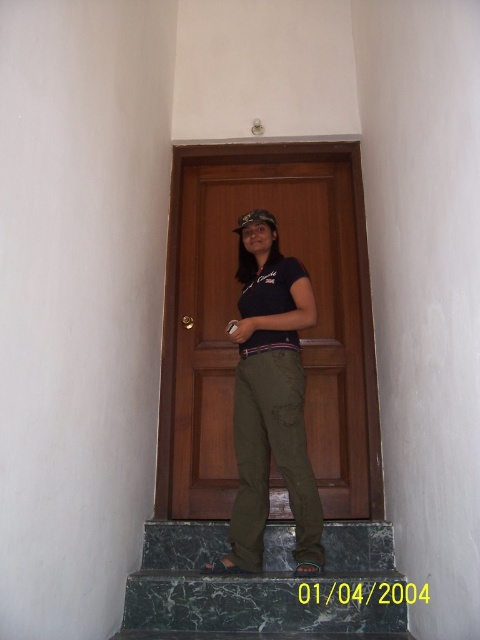
Between point (214, 392) and point (253, 346), which one is positioned in front?

Positioned in front is point (253, 346).

Can you confirm if brown wooden door at center is wider than olive green pants at center?

Yes.

Find the location of `brown wooden door at center`. brown wooden door at center is located at coordinates (237, 316).

Is point (249, 589) in front of point (242, 364)?

Yes, point (249, 589) is in front of point (242, 364).

Does green marble stairs at center have a greater height compared to olive green pants at center?

No, green marble stairs at center is not taller than olive green pants at center.

You are a GUI agent. You are given a task and a screenshot of the screen. Output one action in this format:
    pyautogui.click(x=<x>, y=<y>)
    Task: Click on the green marble stairs at center
    
    Given the screenshot: What is the action you would take?
    pyautogui.click(x=265, y=588)

Can you confirm if brown wooden door at center is wider than green marble stairs at center?

No.

Looking at this image, can you confirm if brown wooden door at center is positioned to the left of green marble stairs at center?

In fact, brown wooden door at center is to the right of green marble stairs at center.

Is point (276, 170) positioned behind point (184, 522)?

Yes.

At what (x,y) coordinates should I click in order to perform the action: click on brown wooden door at center. Please return your answer as a coordinate pair (x, y). Image resolution: width=480 pixels, height=640 pixels. Looking at the image, I should click on (237, 316).